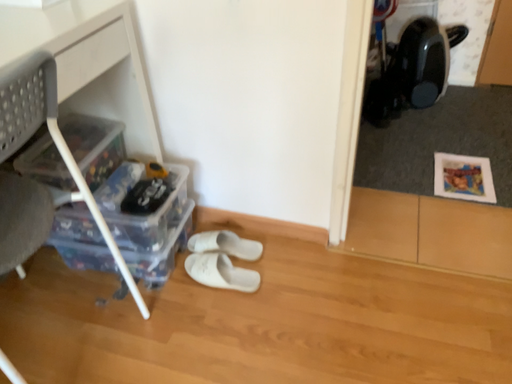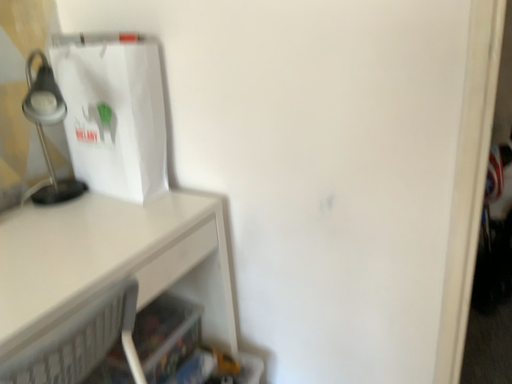
Question: Which way did the camera rotate in the video?

Choices:
 (A) rotated downward
 (B) rotated upward

Answer: (B)